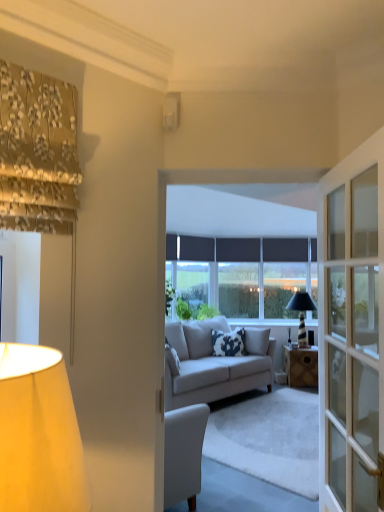
Question: Which is correct: wooden desk at center is inside matte black window at center, or outside of it?

Choices:
 (A) inside
 (B) outside

Answer: (B)

Question: From the image's perspective, is wooden desk at center located above or below matte black window at center?

Choices:
 (A) above
 (B) below

Answer: (B)

Question: Estimate the real-world distances between objects in this image. Which object is closer to the white fabric lampshade at left, placed as the third lamp when sorted from right to left?

Choices:
 (A) white cotton pillow at center
 (B) matte black window at center
 (C) white glossy switch at upper center, which is the 2th lamp from front to back
 (D) light gray fabric couch at center
 (E) black glass lamp at center, the 1th lamp in the right-to-left sequence

Answer: (C)

Question: Considering the real-world distances, which object is farthest from the white cotton pillow at center?

Choices:
 (A) wooden desk at center
 (B) light gray fabric couch at center
 (C) white glossy switch at upper center, arranged as the 2th lamp when viewed from the left
 (D) matte black window at center
 (E) black glass lamp at center, which is the third lamp in left-to-right order

Answer: (C)